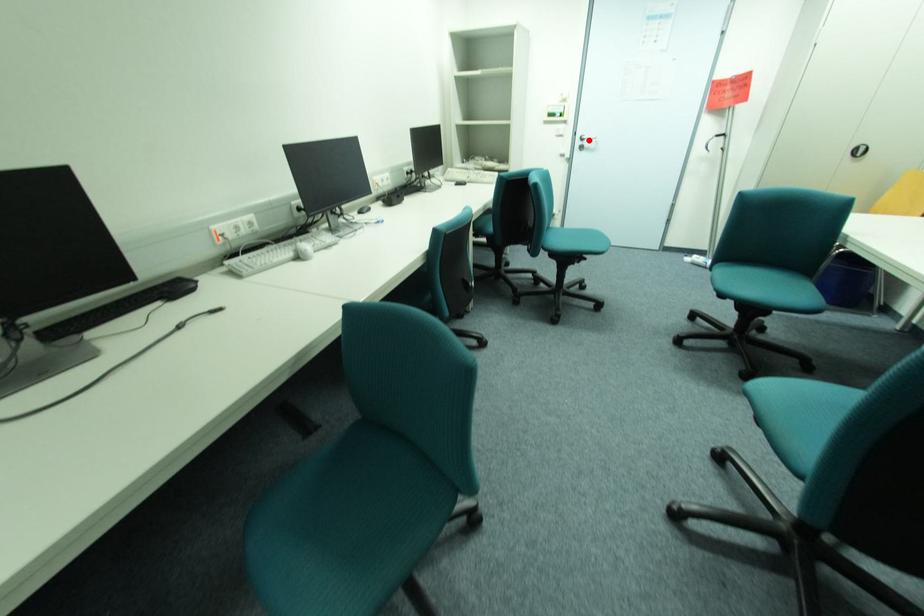
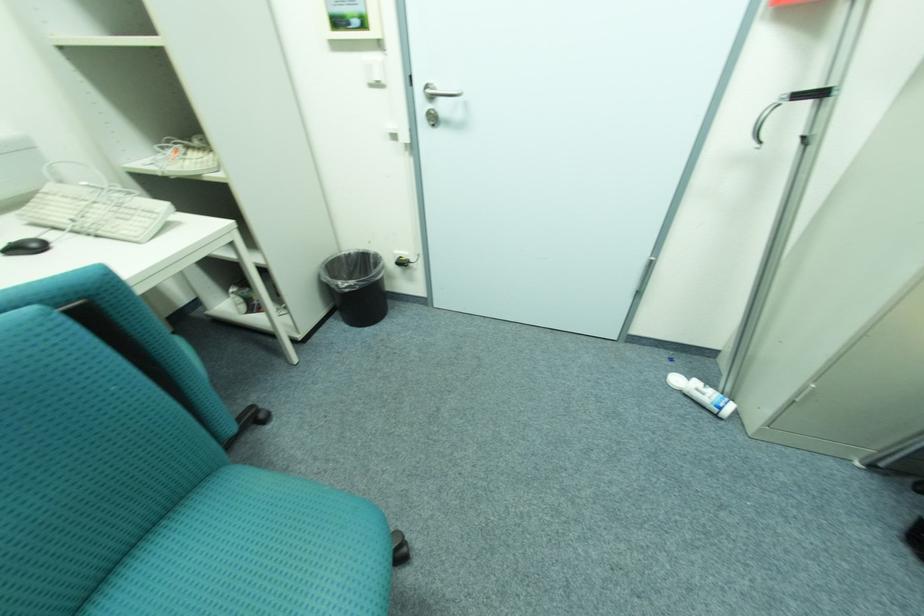
Locate, in the second image, the point that corresponds to the highlighted location in the first image.

(439, 97)